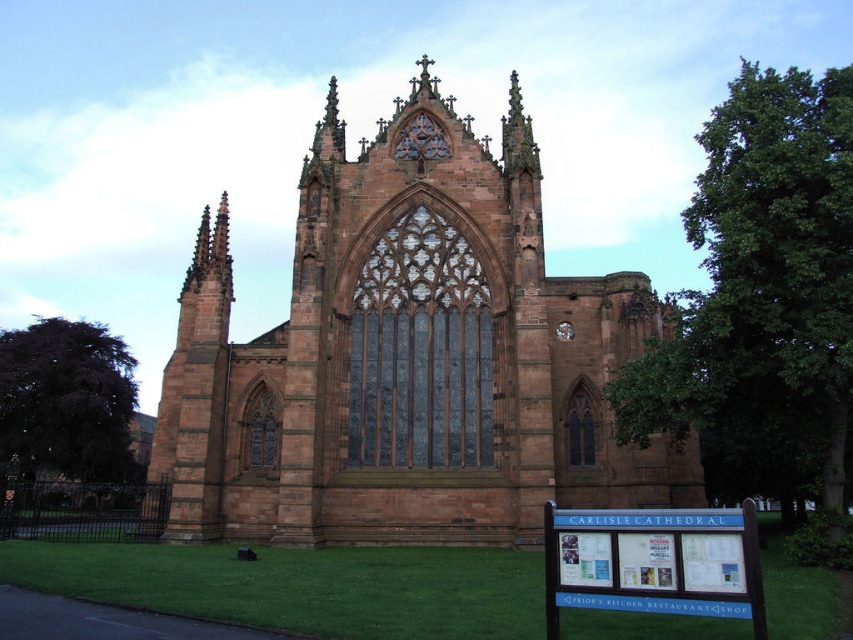
Based on the photo, between brown stone church at center and blue plastic sign at lower right, which one appears on the left side from the viewer's perspective?

From the viewer's perspective, brown stone church at center appears more on the left side.

Which is above, brown stone church at center or blue plastic sign at lower right?

Positioned higher is brown stone church at center.

Does point (300, 544) lie in front of point (659, 563)?

No, (300, 544) is behind (659, 563).

You are a GUI agent. You are given a task and a screenshot of the screen. Output one action in this format:
    pyautogui.click(x=<x>, y=<y>)
    Task: Click on the brown stone church at center
    The image size is (853, 640).
    Given the screenshot: What is the action you would take?
    pyautogui.click(x=407, y=356)

This screenshot has height=640, width=853. What do you see at coordinates (407, 356) in the screenshot?
I see `brown stone church at center` at bounding box center [407, 356].

Is point (590, 280) positioned before point (4, 563)?

No, (590, 280) is behind (4, 563).

Identify the location of brown stone church at center. This screenshot has width=853, height=640. (407, 356).

The width and height of the screenshot is (853, 640). Identify the location of brown stone church at center. (407, 356).

Does green grass at lower center appear on the right side of blue plastic sign at lower right?

In fact, green grass at lower center is to the left of blue plastic sign at lower right.

The image size is (853, 640). Describe the element at coordinates (303, 586) in the screenshot. I see `green grass at lower center` at that location.

Who is more forward, (x=236, y=600) or (x=544, y=538)?

Point (x=544, y=538)

This screenshot has height=640, width=853. What are the coordinates of `green grass at lower center` in the screenshot? It's located at (303, 586).